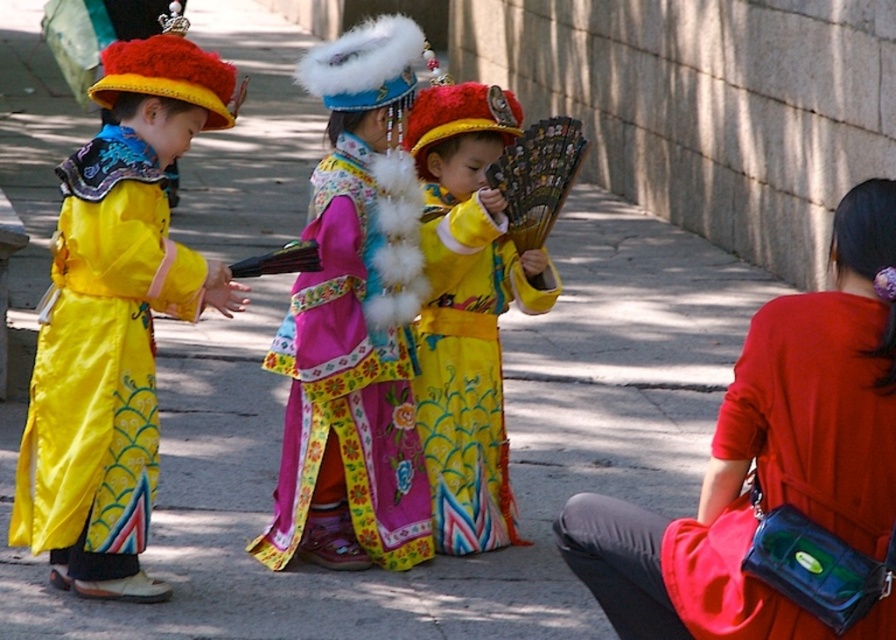
In the scene shown: In the scene with three children in traditional Chinese attire, you need to determine which costume is narrower between the floral satin robe at center and the matte yellow costume at center. Based on their positions and the given information, which one is narrower?

The floral satin robe at center is narrower than the matte yellow costume at center.

You are a photographer standing in front of the three children. You need to take a photo that includes both the shiny yellow robe at left and the floral satin robe at center. Based on their positions, which robe should be placed lower in the photo to ensure both are visible?

The shiny yellow robe at left is located below the floral satin robe at center, so to ensure both are visible in the photo, the shiny yellow robe at left should be placed lower in the photo.

You are a costume designer preparing for a cultural performance. You have two robes to place on a display stand. The shiny yellow robe at left and the floral satin robe at center. Which robe should you choose if you want the one that is bigger in size?

The shiny yellow robe at left has a larger size compared to the floral satin robe at center, so you should choose the shiny yellow robe at left.